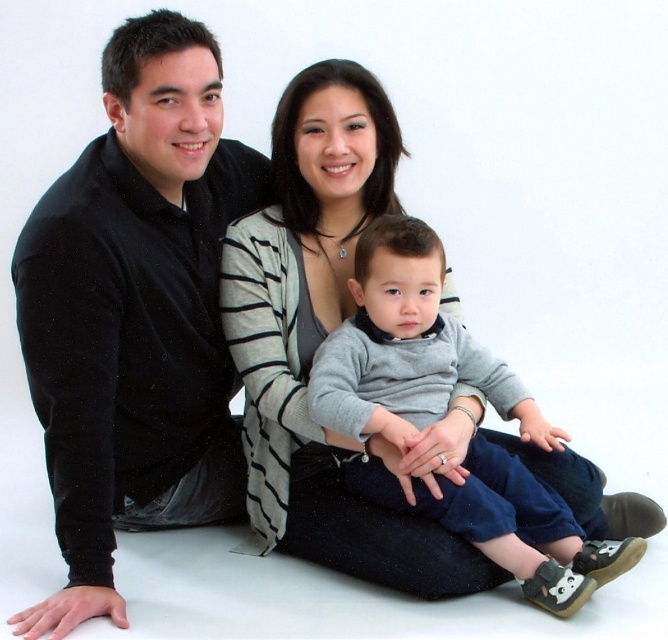
Is black velvet sweater at left positioned before gray soft sweater at center?

That is True.

Measure the distance between black velvet sweater at left and gray soft sweater at center.

black velvet sweater at left is 47.30 centimeters from gray soft sweater at center.

Is point (112, 305) positioned in front of point (381, 323)?

Yes, it is.

The image size is (668, 640). I want to click on black velvet sweater at left, so click(136, 314).